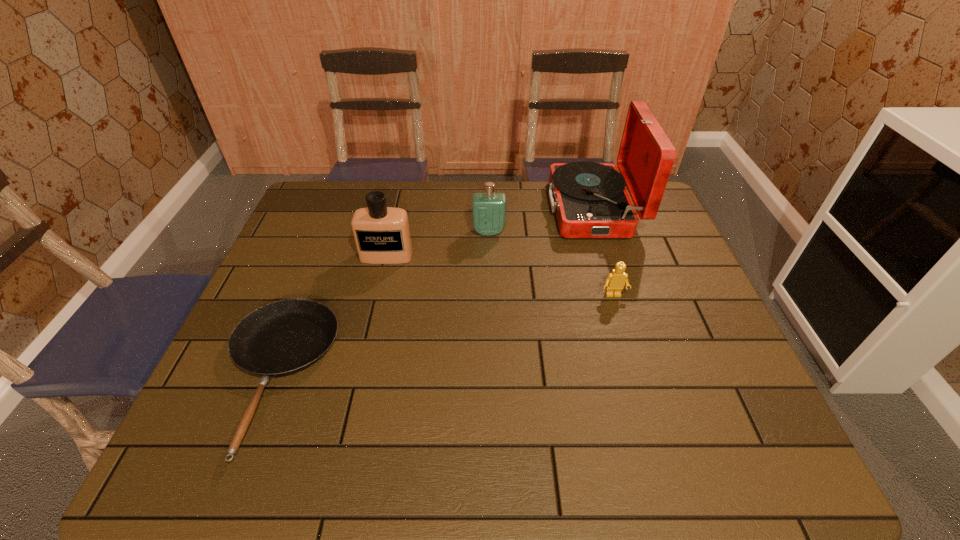
Locate an element on the screen. Image resolution: width=960 pixels, height=540 pixels. vacant space located 0.310m on the front-facing side of the tallest object is located at coordinates (456, 209).

Find the location of a particular element. The width and height of the screenshot is (960, 540). vacant space located on the front-facing side of the tallest object is located at coordinates (480, 209).

The width and height of the screenshot is (960, 540). Identify the location of free location located on the front label of the second tallest object. (372, 320).

Identify the location of vacant space located on the front label of the farther perfume. (491, 333).

Locate an element on the screen. The width and height of the screenshot is (960, 540). vacant space positioned on the face of the fourth tallest object is located at coordinates (635, 368).

Where is `free space located on the back of the frying pan`? This screenshot has height=540, width=960. free space located on the back of the frying pan is located at coordinates (332, 230).

I want to click on object situated at the far edge, so click(x=590, y=199).

The width and height of the screenshot is (960, 540). I want to click on object positioned at the near edge, so click(x=284, y=337).

Locate an element on the screen. object present at the left edge is located at coordinates (284, 337).

Identify the location of object that is positioned at the right edge. Image resolution: width=960 pixels, height=540 pixels. (590, 199).